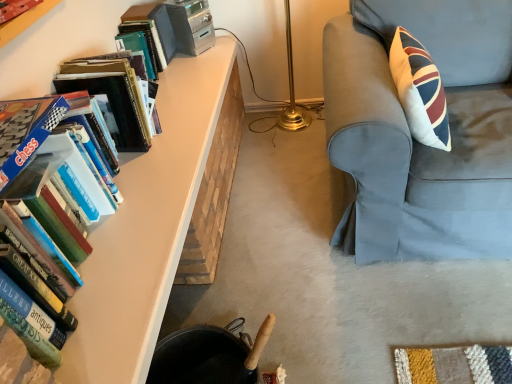
You are a GUI agent. You are given a task and a screenshot of the screen. Output one action in this format:
    pyautogui.click(x=<x>, y=<y>)
    Task: Click on the free space in front of hardcover book at upper left, positioned as the 1th book in back-to-front order
    Image resolution: width=512 pixels, height=384 pixels.
    Given the screenshot: What is the action you would take?
    pyautogui.click(x=175, y=88)